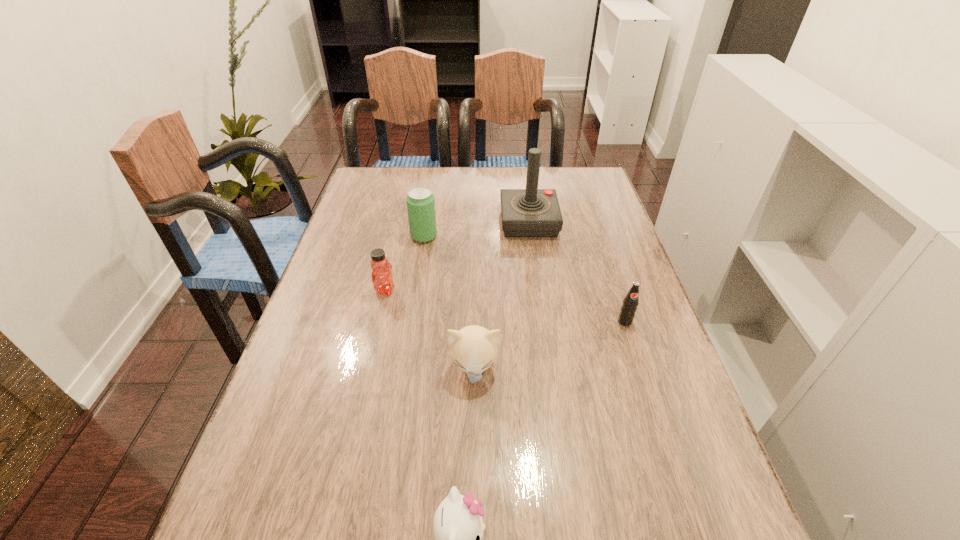
Select which object appears as the second closest to the fourth nearest object. Please provide its 2D coordinates. Your answer should be formatted as a tuple, i.e. [(x, y)], where the tuple contains the x and y coordinates of a point satisfying the conditions above.

[(473, 349)]

This screenshot has width=960, height=540. Find the location of `the second closest object relative to the tallest object`. the second closest object relative to the tallest object is located at coordinates (630, 302).